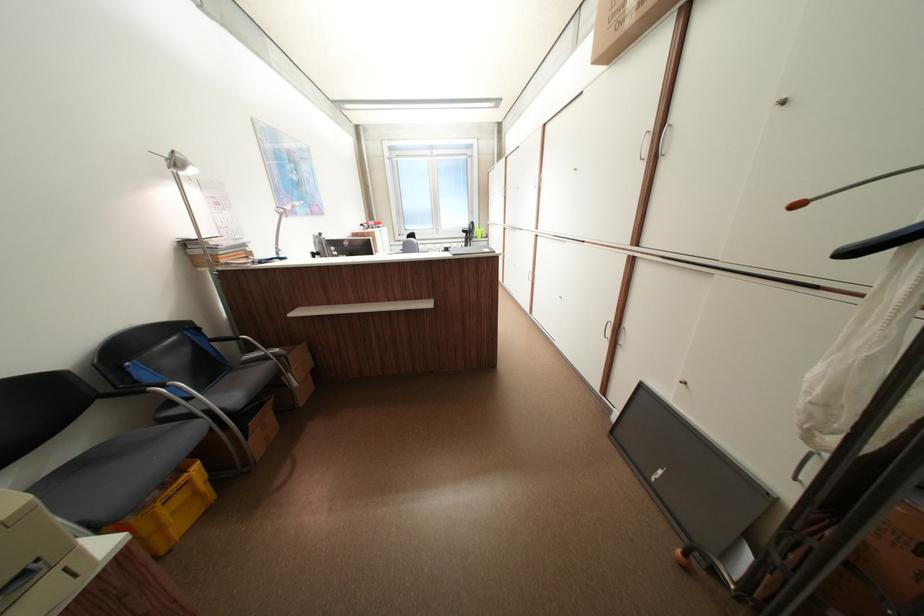
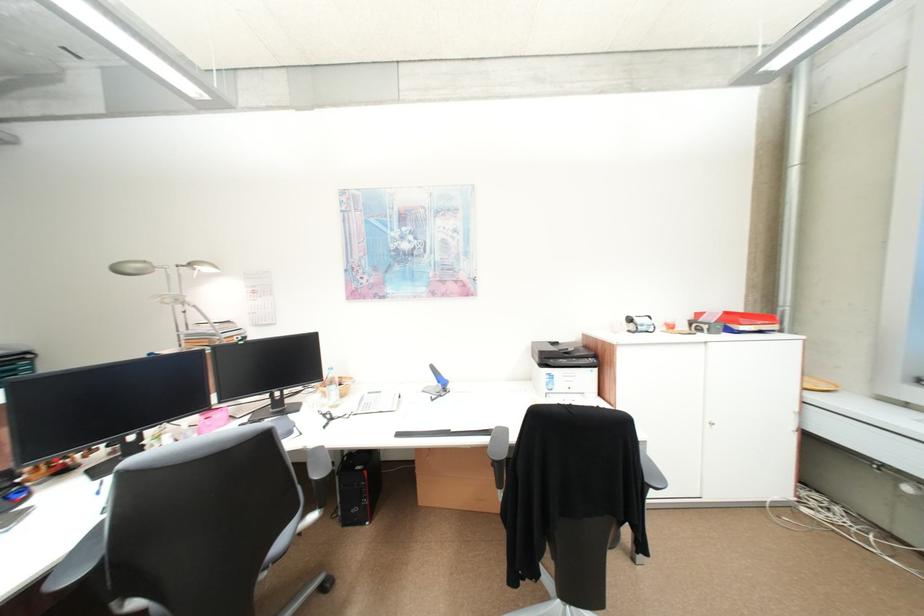
Question: I am providing you with two images of the same scene from different viewpoints. Please identify which objects are invisible in image2.

Choices:
 (A) black chair armrest
 (B) purple handled scissors
 (C) cardboard box
 (D) printer scanner lid

Answer: (C)